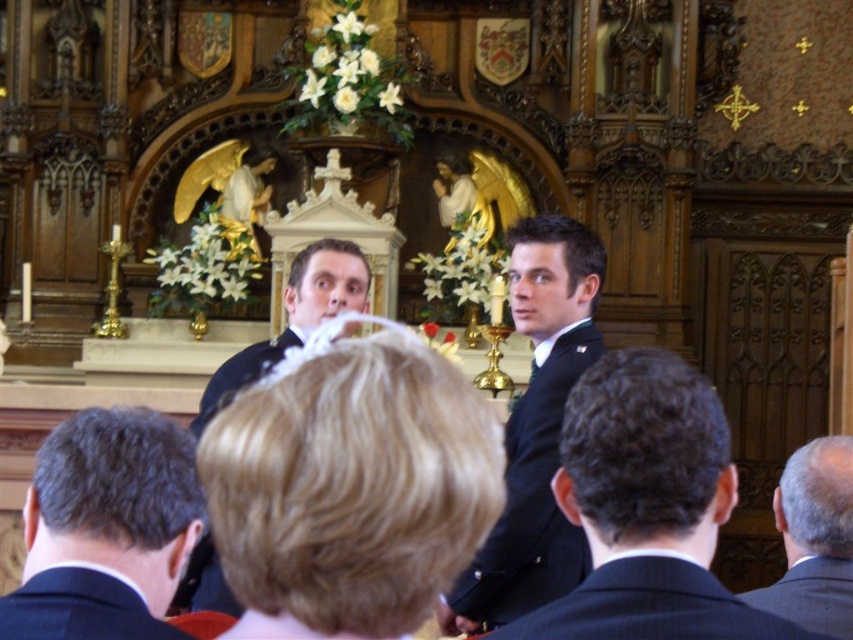
Does point (593, 248) lie behind point (799, 483)?

Yes, point (593, 248) is farther from viewer.

Is dark blue uniform at center to the right of dark brown suit at lower right from the viewer's perspective?

No, dark blue uniform at center is not to the right of dark brown suit at lower right.

At what (x,y) coordinates should I click in order to perform the action: click on dark blue uniform at center. Please return your answer as a coordinate pair (x, y). Looking at the image, I should click on (537, 428).

Who is more distant from viewer, (x=589, y=476) or (x=85, y=432)?

The point (x=85, y=432) is behind.

What do you see at coordinates (647, 508) in the screenshot? This screenshot has width=853, height=640. I see `dark blue suit at center` at bounding box center [647, 508].

Identify the location of dark blue suit at center. Image resolution: width=853 pixels, height=640 pixels. (647, 508).

Can you confirm if dark blue suit at center is taller than dark blue uniform at center?

No.

Describe the element at coordinates (647, 508) in the screenshot. I see `dark blue suit at center` at that location.

Between point (589, 636) and point (538, 522), which one is positioned behind?

The point (538, 522) is behind.

I want to click on dark blue suit at center, so click(x=647, y=508).